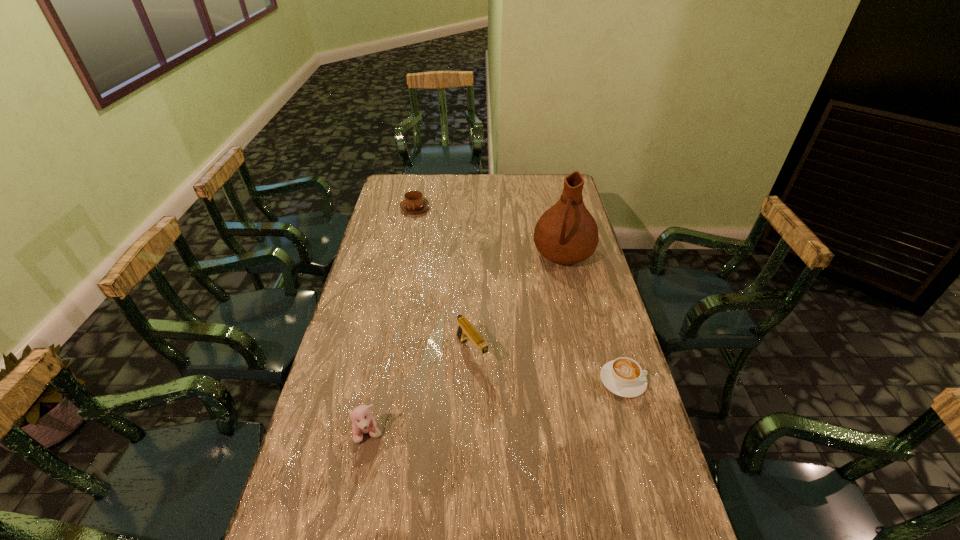
Image resolution: width=960 pixels, height=540 pixels. Identify the location of vacant point located between the pitcher and the third object from left to right. (517, 302).

Locate an element on the screen. The height and width of the screenshot is (540, 960). vacant point located between the nearest object and the taller cappuccino is located at coordinates coord(392,321).

Locate an element on the screen. The width and height of the screenshot is (960, 540). vacant area that lies between the farther cappuccino and the pistol is located at coordinates (443, 280).

Image resolution: width=960 pixels, height=540 pixels. What are the coordinates of `vacant area between the shorter cappuccino and the teddy bear` in the screenshot? It's located at (495, 407).

Where is `vacant region between the farthest object and the pitcher`? This screenshot has width=960, height=540. vacant region between the farthest object and the pitcher is located at coordinates (490, 231).

Find the location of a particular element. The image size is (960, 540). unoccupied area between the tallest object and the farther cappuccino is located at coordinates (490, 231).

Identify the location of free space between the left cappuccino and the pistol. (443, 280).

This screenshot has width=960, height=540. Identify the location of object identified as the closest to the tallest object. (465, 330).

Identify which object is the fourth closest to the shorter cappuccino. Please provide its 2D coordinates. Your answer should be formatted as a tuple, i.e. [(x, y)], where the tuple contains the x and y coordinates of a point satisfying the conditions above.

[(414, 202)]

Identify the location of free space that satisfies the following two spatial constraints: 1. on the front side of the shorter cappuccino; 2. on the side of the third object from left to right with the handle. (470, 381).